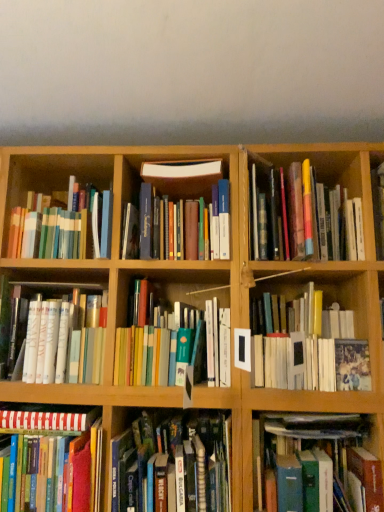
Question: From a real-world perspective, is hardcover books at center, the 5th book when ordered from left to right, on hardcover book at center right, which is the 2th book from right to left?

Choices:
 (A) no
 (B) yes

Answer: (A)

Question: From the image's perspective, is hardcover books at center, positioned as the fifth book in right-to-left order, under hardcover book at center right, which is the 2th book from right to left?

Choices:
 (A) no
 (B) yes

Answer: (B)

Question: Is hardcover books at center, positioned as the fifth book in right-to-left order, smaller than hardcover book at center right, which is the 2th book from right to left?

Choices:
 (A) no
 (B) yes

Answer: (B)

Question: Is hardcover books at center, positioned as the fifth book in right-to-left order, aimed at hardcover book at center right, which is the 2th book from right to left?

Choices:
 (A) yes
 (B) no

Answer: (B)

Question: Are hardcover books at center, the 5th book when ordered from left to right, and hardcover book at center right, which is the 2th book from right to left, far apart?

Choices:
 (A) yes
 (B) no

Answer: (B)

Question: Would you say hardcover book at center, which is the 6th book from left to right, is to the left or to the right of hardcover books at center, positioned as the fifth book in right-to-left order, in the picture?

Choices:
 (A) left
 (B) right

Answer: (B)

Question: In terms of width, does hardcover book at center, the fourth book viewed from the right, look wider or thinner when compared to hardcover books at center, the 5th book when ordered from left to right?

Choices:
 (A) thin
 (B) wide

Answer: (B)

Question: Looking at the image, does hardcover book at center, the fourth book viewed from the right, seem bigger or smaller compared to hardcover books at center, positioned as the fifth book in right-to-left order?

Choices:
 (A) big
 (B) small

Answer: (B)

Question: From the image's perspective, is hardcover book at center, the fourth book viewed from the right, positioned above or below hardcover books at center, the 5th book when ordered from left to right?

Choices:
 (A) above
 (B) below

Answer: (A)

Question: Would you say hardcover books at upper right, placed as the 9th book when sorted from left to right, is to the left or to the right of multicolored hardcover books at upper left, the 7th book in the right-to-left sequence, in the picture?

Choices:
 (A) left
 (B) right

Answer: (B)

Question: In terms of width, does hardcover books at upper right, placed as the 9th book when sorted from left to right, look wider or thinner when compared to multicolored hardcover books at upper left, the third book in the left-to-right sequence?

Choices:
 (A) wide
 (B) thin

Answer: (A)

Question: Is hardcover books at upper right, marked as the first book in a right-to-left arrangement, spatially inside multicolored hardcover books at upper left, the third book in the left-to-right sequence, or outside of it?

Choices:
 (A) outside
 (B) inside

Answer: (A)

Question: Is point (322, 224) closer or farther from the camera than point (82, 230)?

Choices:
 (A) closer
 (B) farther

Answer: (A)

Question: Is white matte book at left, placed as the 8th book when sorted from right to left, inside or outside of hardcover book at center right, which is the eighth book from left to right?

Choices:
 (A) inside
 (B) outside

Answer: (B)

Question: Is white matte book at left, the second book viewed from the left, taller or shorter than hardcover book at center right, which is the eighth book from left to right?

Choices:
 (A) tall
 (B) short

Answer: (B)